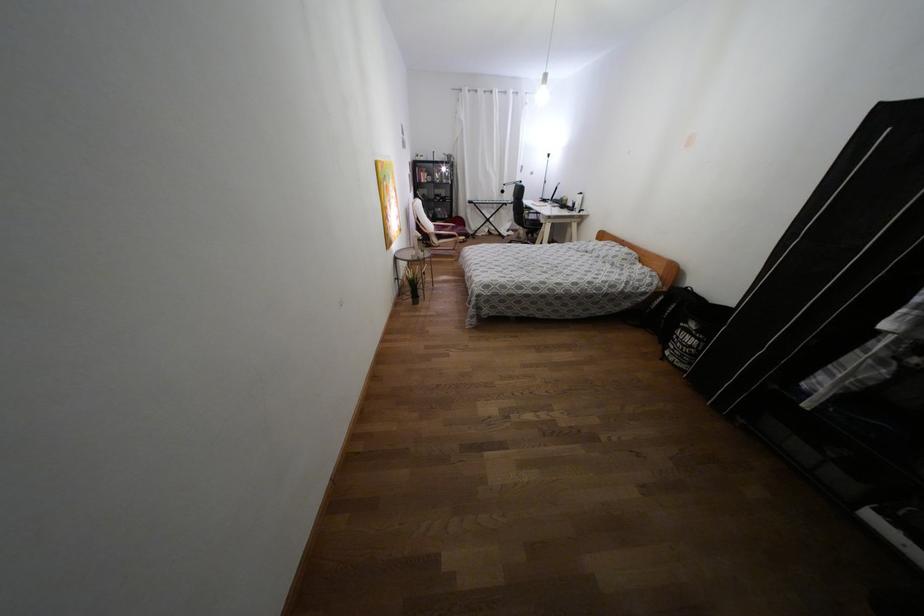
Find where to sit the black office chair sitting surface. Please return your answer as a coordinate pair (x, y).

(532, 222)